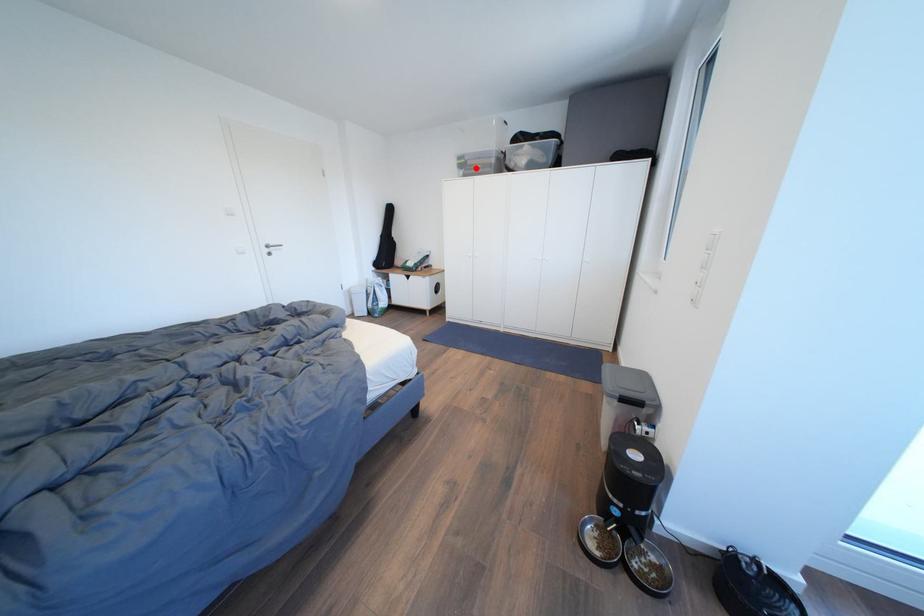
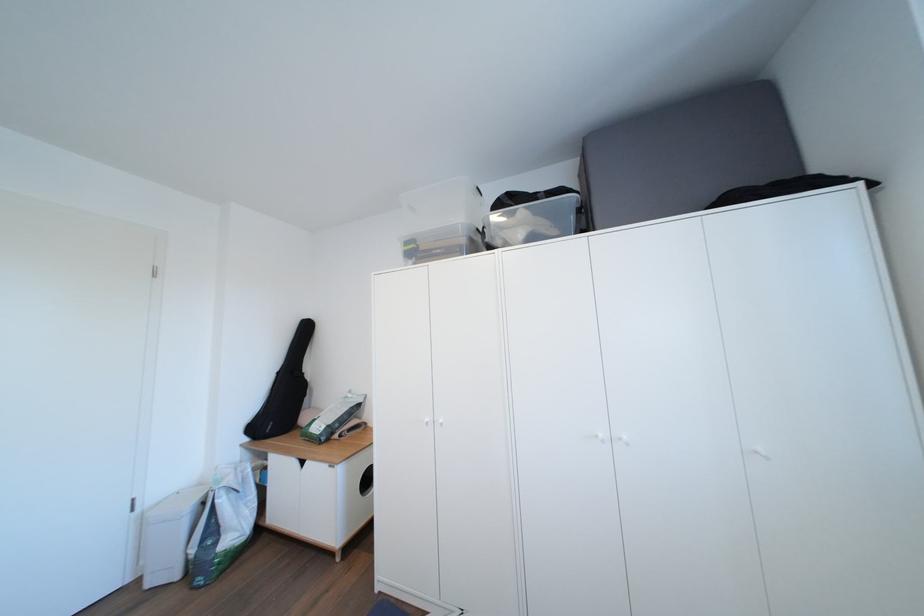
The point at the highlighted location is marked in the first image. Where is the corresponding point in the second image?

(429, 254)